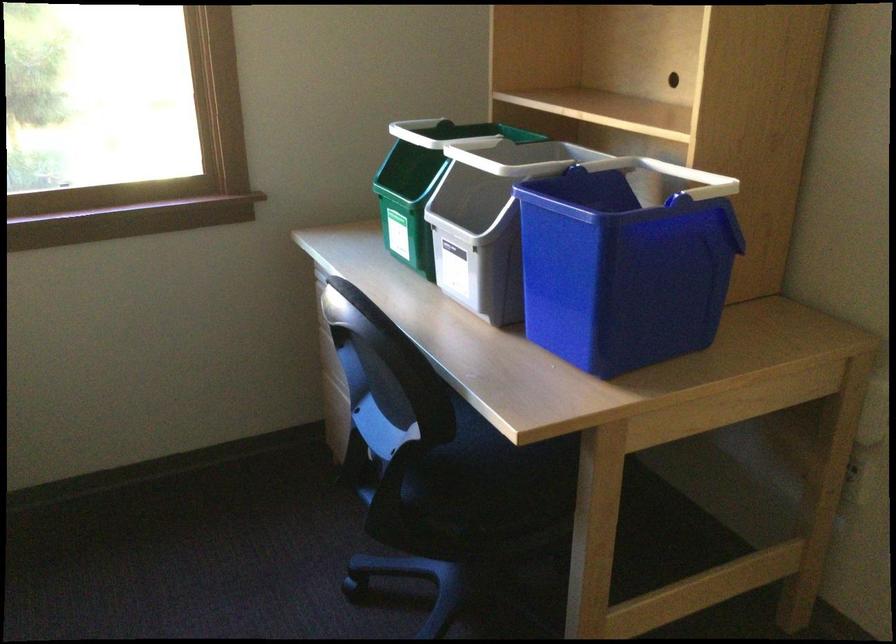
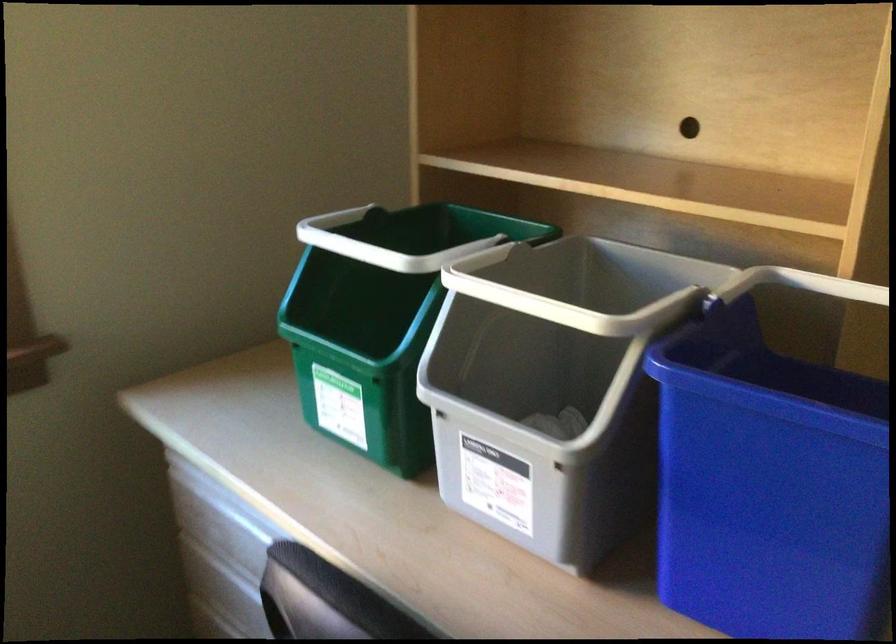
What movement of the cameraman would produce the second image?

The cameraman walked toward left, forward.